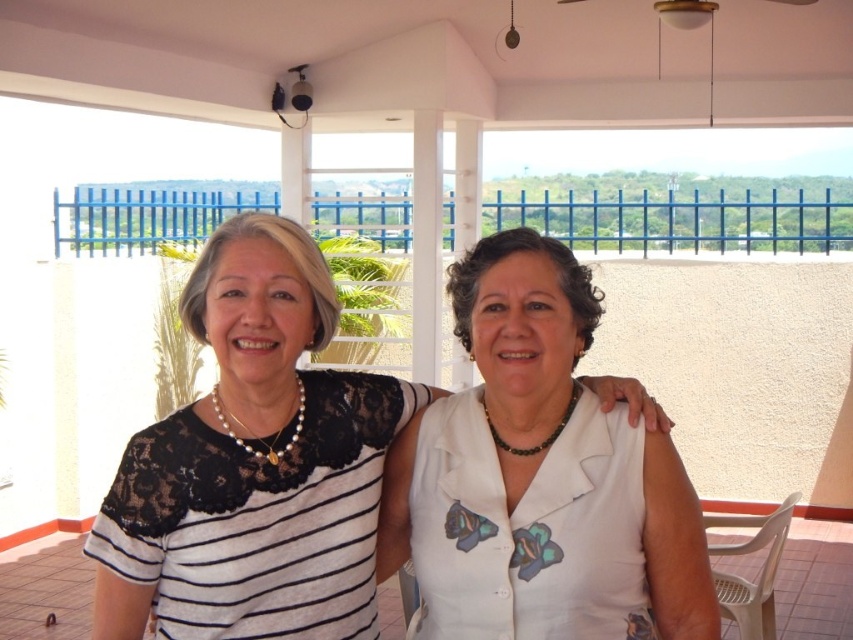
You are a tailor measuring the distance between two garments displayed on a mannequin. The garments are the white lace top at center and the white matte blouse at center. The minimum space required between them for proper display is 15 inches. Is the current distance sufficient?

The white lace top at center is 14.99 inches from the white matte blouse at center. Since the required minimum space is 15 inches, the current distance is insufficient by 0.01 inches.

You are a photographer trying to capture a clear shot of the two women on the balcony. You notice the white matte blouse at center and the white fabric at center. Which object should you focus on to ensure it appears sharp and in focus first?

The white matte blouse at center is closer to the viewer than the white fabric at center, so focusing on the white matte blouse at center first will ensure it appears sharp. Adjust focus accordingly based on their positions.